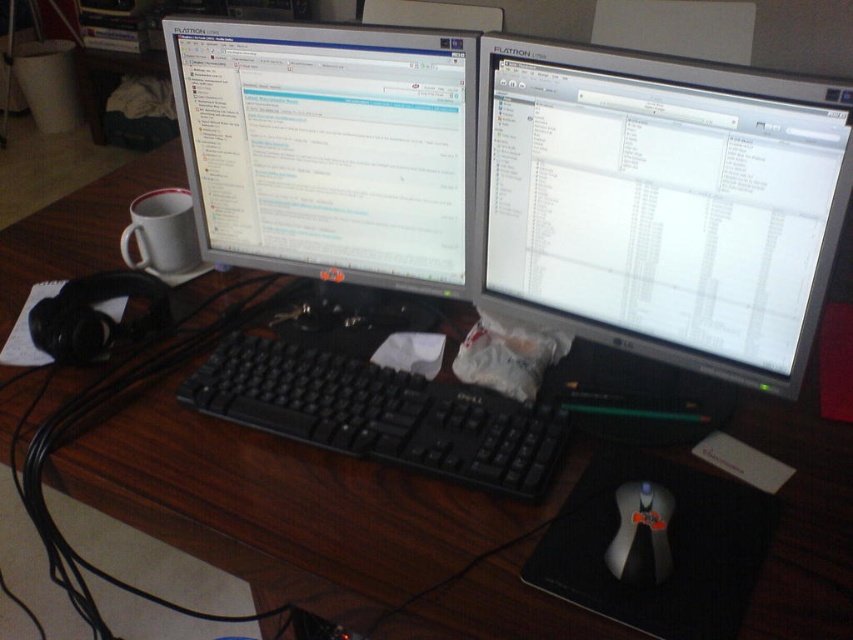
Question: Can you confirm if matte black monitor at center is positioned below white matte mug at left?

Choices:
 (A) no
 (B) yes

Answer: (A)

Question: Which point appears farthest from the camera in this image?

Choices:
 (A) (184, 220)
 (B) (671, 236)
 (C) (672, 513)

Answer: (A)

Question: Can you confirm if silver metallic monitor at center is wider than white matte mug at left?

Choices:
 (A) yes
 (B) no

Answer: (A)

Question: Which of the following is the farthest from the observer?

Choices:
 (A) (337, 186)
 (B) (476, 406)
 (C) (627, 488)
 (D) (151, 232)

Answer: (D)

Question: Is matte black monitor at center positioned at the back of black plastic mouse at center?

Choices:
 (A) yes
 (B) no

Answer: (A)

Question: Which object is closer to the camera taking this photo?

Choices:
 (A) silver metallic monitor at center
 (B) white matte mug at left
 (C) matte black monitor at center
 (D) black plastic keyboard at center

Answer: (A)